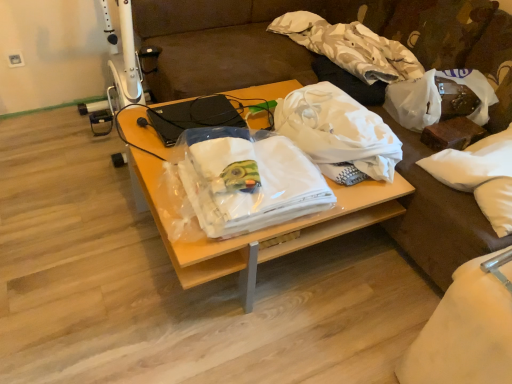
At what (x,y) coordinates should I click in order to perform the action: click on free location to the left of white fabric at center. Please return your answer as a coordinate pair (x, y). Looking at the image, I should click on (69, 225).